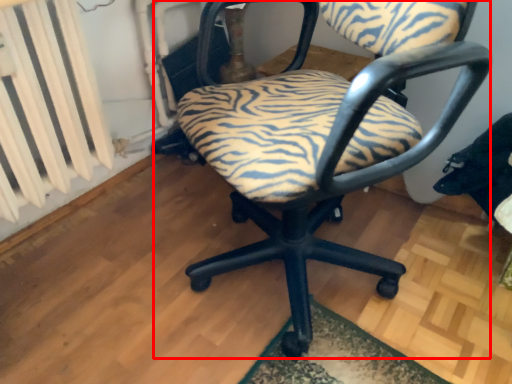
Question: From the image's perspective, what is the correct spatial relationship of chair (annotated by the red box) in relation to radiator?

Choices:
 (A) below
 (B) above

Answer: (A)